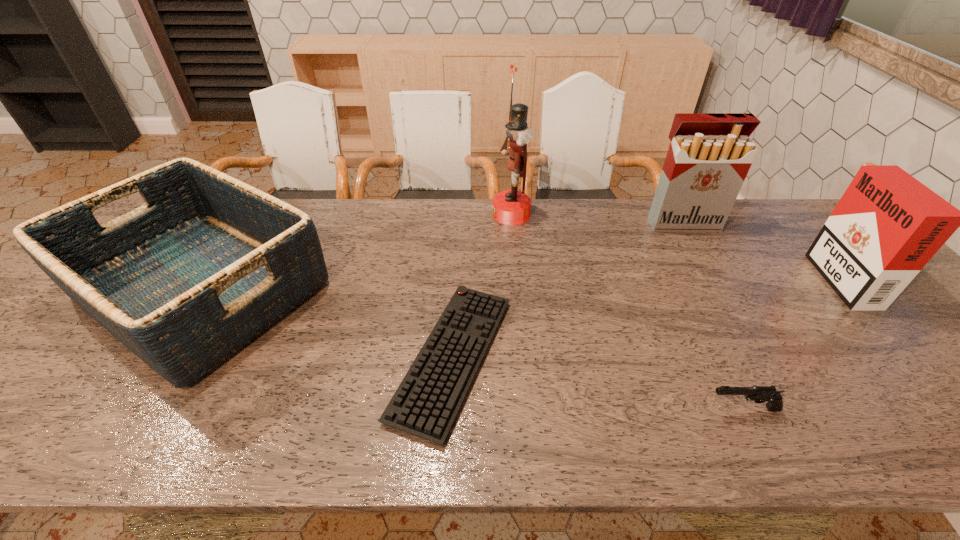
Locate an element on the screen. Image resolution: width=960 pixels, height=540 pixels. free space located on the front-facing side of the shorter cigarette case is located at coordinates (755, 274).

The height and width of the screenshot is (540, 960). I want to click on vacant space located on the front-facing side of the shorter cigarette case, so click(x=758, y=274).

At what (x,y) coordinates should I click in order to perform the action: click on free spot located on the front-facing side of the shorter cigarette case. Please return your answer as a coordinate pair (x, y). Image resolution: width=960 pixels, height=540 pixels. Looking at the image, I should click on (736, 274).

The width and height of the screenshot is (960, 540). Find the location of `blank space located at the end of the barrel of the gun`. blank space located at the end of the barrel of the gun is located at coordinates 575,409.

I want to click on free point located 0.150m at the end of the barrel of the gun, so click(x=634, y=409).

Where is `free space located 0.050m at the end of the barrel of the gun`? The width and height of the screenshot is (960, 540). free space located 0.050m at the end of the barrel of the gun is located at coordinates click(682, 409).

This screenshot has width=960, height=540. Identify the location of free space located on the back of the shortest object. (460, 219).

This screenshot has width=960, height=540. Find the location of `nutcracker situated at the far edge`. nutcracker situated at the far edge is located at coordinates (511, 207).

Identify the location of gun present at the near edge. (759, 394).

The image size is (960, 540). What are the coordinates of `computer keyboard that is at the near edge` in the screenshot? It's located at (426, 403).